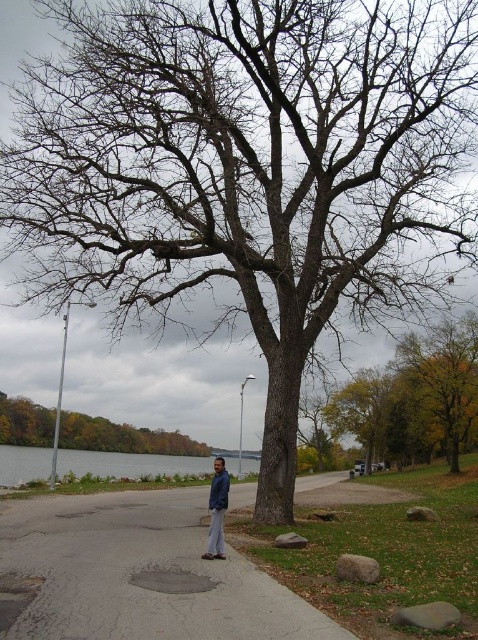
You are standing at the base of the large, leafless tree and want to walk to the point marked as point (113,630). There is another point marked as point (106,438) along the way. Which point will you encounter first on your path?

You will encounter point (113,630) first because it is closer to the camera, meaning it is nearer to your starting position at the base of the large, leafless tree compared to point (106,438) which is further away.

You are standing on the pathway and see the gray water at lower left and the blue denim jacket at center. Which object is taller from your viewpoint?

The blue denim jacket at center is taller than the gray water at lower left.

You are standing at the brown rough tree at center in the serene outdoor scene. You want to place the blue denim jacket at center on a nearby bench that is exactly 10 meters away from the tree. Is the jacket currently positioned correctly?

The blue denim jacket at center is 10.58 meters away from the brown rough tree at center, which is further than the required 10 meters. Therefore, the jacket is not positioned correctly and needs to be moved closer to the tree.